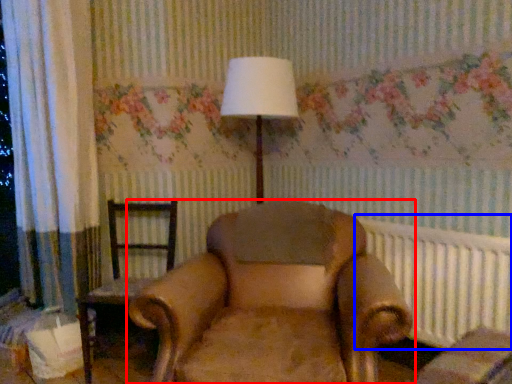
Question: Which point is closer to the camera, chair (highlighted by a red box) or radiator (highlighted by a blue box)?

Choices:
 (A) chair
 (B) radiator

Answer: (A)